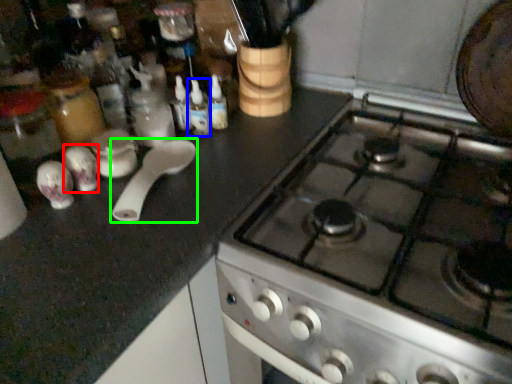
Question: Estimate the real-world distances between objects in this image. Which object is farther from tableware (highlighted by a red box), bottle (highlighted by a blue box) or kitchen appliance (highlighted by a green box)?

Choices:
 (A) bottle
 (B) kitchen appliance

Answer: (A)